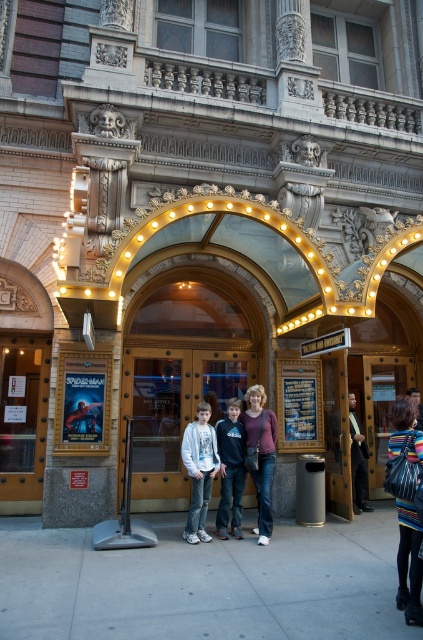
Does wooden door at left have a greater width compared to light gray hoodie at center?

Yes, wooden door at left is wider than light gray hoodie at center.

From the picture: Who is more distant from viewer, [21,397] or [198,522]?

The point [21,397] is more distant.

What are the coordinates of `wooden door at left` in the screenshot? It's located at pyautogui.click(x=22, y=420).

Consider the image. Which is below, wooden door at left or dark blue hoodie at center?

dark blue hoodie at center

Consider the image. Can you confirm if wooden door at left is positioned to the left of dark blue hoodie at center?

Yes, wooden door at left is to the left of dark blue hoodie at center.

Is point (3, 436) in front of point (233, 513)?

That is False.

The image size is (423, 640). I want to click on wooden door at left, so click(22, 420).

Is denim jeans at center further to camera compared to dark blue hoodie at center?

No, denim jeans at center is in front of dark blue hoodie at center.

Consider the image. Measure the distance between denim jeans at center and camera.

The distance of denim jeans at center from camera is 6.69 meters.

Identify the location of denim jeans at center. (260, 456).